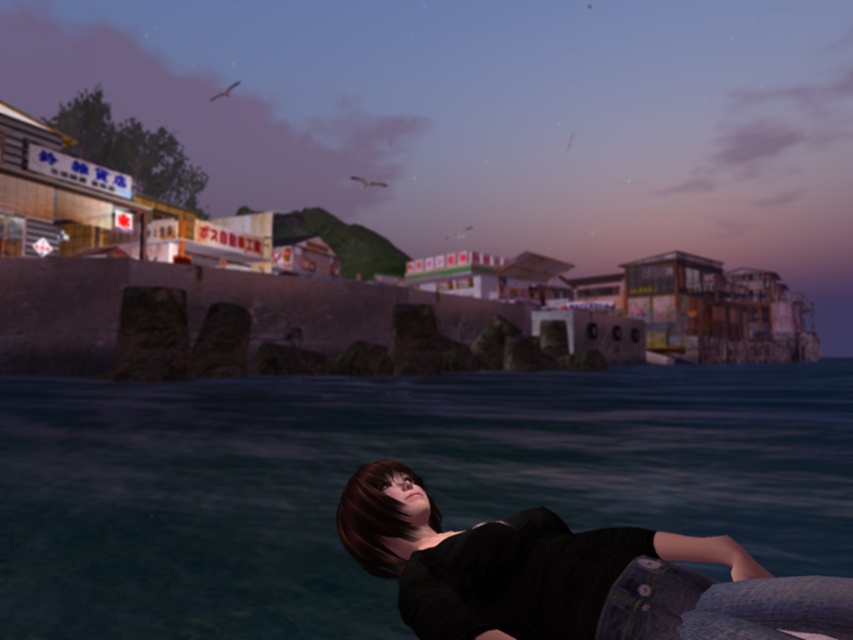
Based on the photo, is smooth concrete wall at lower center wider than blue water at lower center?

Yes, smooth concrete wall at lower center is wider than blue water at lower center.

Is smooth concrete wall at lower center positioned at the back of blue water at lower center?

Yes.

The width and height of the screenshot is (853, 640). In order to click on smooth concrete wall at lower center in this screenshot , I will do [496, 120].

You are a GUI agent. You are given a task and a screenshot of the screen. Output one action in this format:
    pyautogui.click(x=<x>, y=<y>)
    Task: Click on the smooth concrete wall at lower center
    This screenshot has width=853, height=640.
    Given the screenshot: What is the action you would take?
    pyautogui.click(x=496, y=120)

Is blue water at lower center thinner than denim jeans at lower right?

In fact, blue water at lower center might be wider than denim jeans at lower right.

Based on the photo, between blue water at lower center and denim jeans at lower right, which one appears on the left side from the viewer's perspective?

denim jeans at lower right is more to the left.

Based on the photo, who is more distant from viewer, [474,465] or [444,582]?

The point [474,465] is behind.

Find the location of `blue water at lower center`. blue water at lower center is located at coordinates (392, 458).

Can you confirm if smooth concrete wall at lower center is smaller than denim jeans at lower right?

Actually, smooth concrete wall at lower center might be larger than denim jeans at lower right.

Which is above, smooth concrete wall at lower center or denim jeans at lower right?

smooth concrete wall at lower center

Who is more distant from viewer, (x=767, y=97) or (x=387, y=472)?

Point (x=767, y=97)

Find the location of a particular element. Image resolution: width=853 pixels, height=640 pixels. smooth concrete wall at lower center is located at coordinates (496, 120).